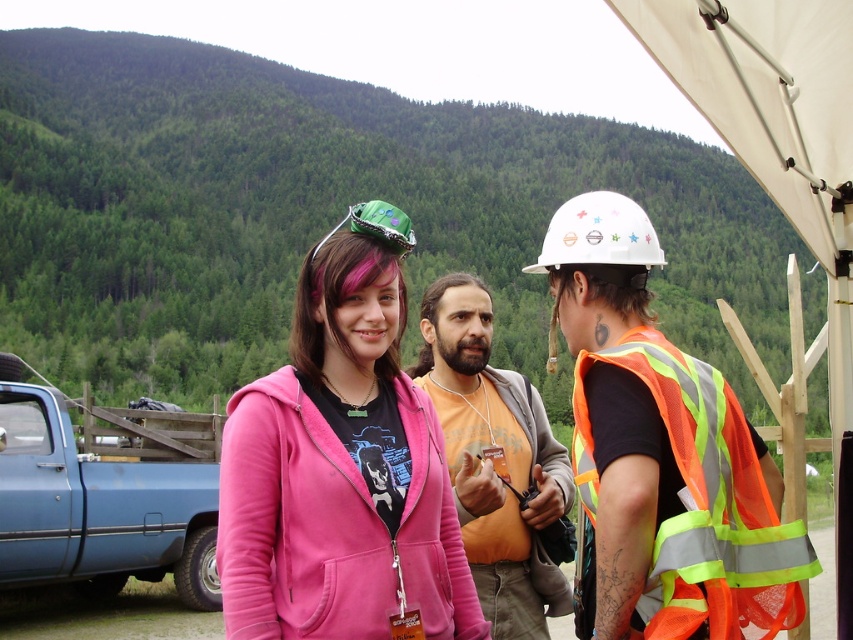
Does pink fleece jacket at center appear over orange cotton shirt at center?

Yes.

Can you confirm if pink fleece jacket at center is bigger than orange cotton shirt at center?

No, pink fleece jacket at center is not bigger than orange cotton shirt at center.

Describe the element at coordinates (341, 467) in the screenshot. I see `pink fleece jacket at center` at that location.

The image size is (853, 640). Identify the location of pink fleece jacket at center. tap(341, 467).

Which of these two, reflective orange safety vest at right or blue matte truck at lower left, stands taller?

With more height is blue matte truck at lower left.

Is point (598, 540) positioned after point (7, 424)?

No, it is in front of (7, 424).

Locate an element on the screen. reflective orange safety vest at right is located at coordinates (662, 449).

Image resolution: width=853 pixels, height=640 pixels. Describe the element at coordinates (341, 467) in the screenshot. I see `pink fleece jacket at center` at that location.

Does pink fleece jacket at center appear under white matte hard hat at center?

Yes.

Does point (242, 589) lie behind point (572, 243)?

That is False.

In order to click on pink fleece jacket at center in this screenshot , I will do `click(341, 467)`.